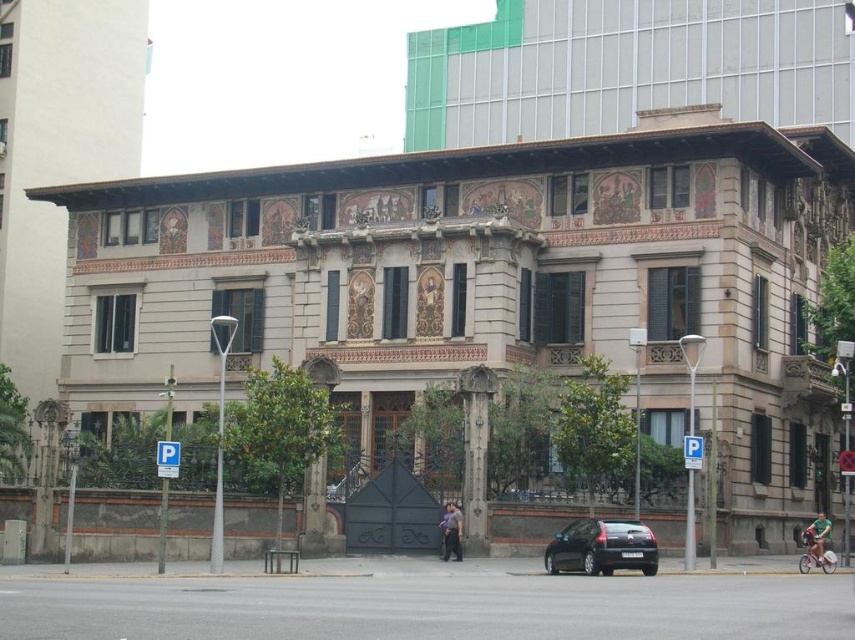
Question: Is shiny black car at lower center bigger than dark gray stone pillar at center?

Choices:
 (A) no
 (B) yes

Answer: (A)

Question: Which point is closer to the camera?

Choices:
 (A) (470, 452)
 (B) (593, 518)

Answer: (B)

Question: Which point appears farthest from the camera in this image?

Choices:
 (A) (652, 561)
 (B) (466, 387)

Answer: (B)

Question: Does shiny black car at lower center appear under dark gray stone pillar at center?

Choices:
 (A) no
 (B) yes

Answer: (B)

Question: Can you confirm if shiny black car at lower center is positioned below dark gray stone pillar at center?

Choices:
 (A) no
 (B) yes

Answer: (B)